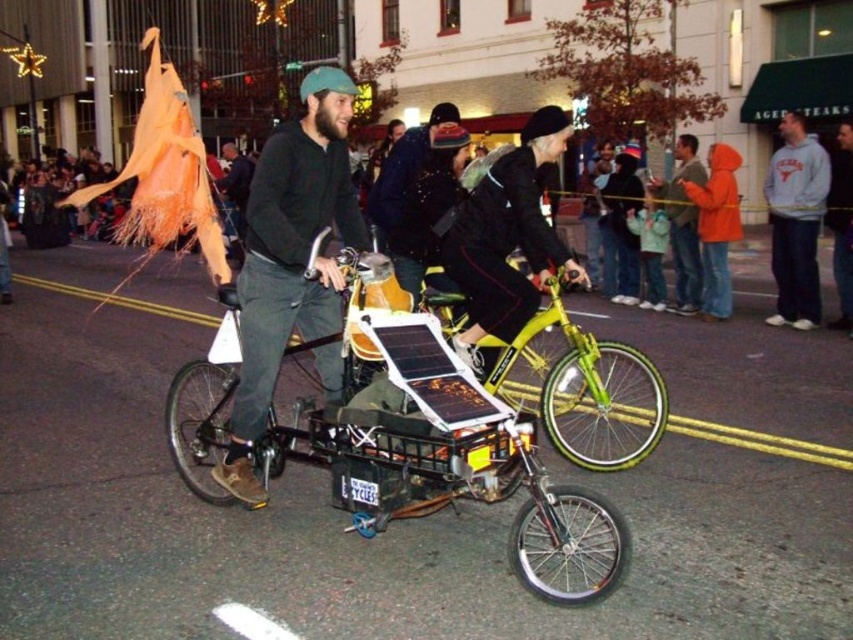
You are a photographer trying to capture the yellow metallic tricycle at center and the gray fleece sweatshirt at upper right in a single shot. Since the camera has a fixed focal length, you need to adjust your position. Considering their sizes, which object should you move closer to in order to include both in the frame without cropping?

Since the yellow metallic tricycle at center is larger than the gray fleece sweatshirt at upper right, you should move closer to the gray fleece sweatshirt at upper right to balance their sizes in the frame.

In the scene shown: You are standing at the point labeled point (355, 310). The street is crowded with people and decorations. If you want to move towards the crowd, which direction should you walk to avoid obstacles?

Since the point (355, 310) is 3.82 meters away from the viewer, you should walk towards the crowd while staying close to the path that leads away from the bicycle to avoid obstacles.